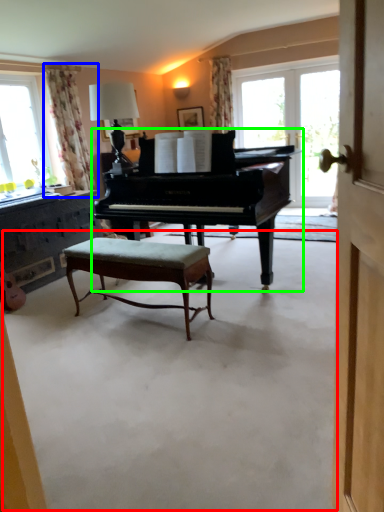
Question: Based on their relative distances, which object is nearer to concrete (highlighted by a red box)? Choose from curtain (highlighted by a blue box) and piano (highlighted by a green box).

Choices:
 (A) curtain
 (B) piano

Answer: (B)